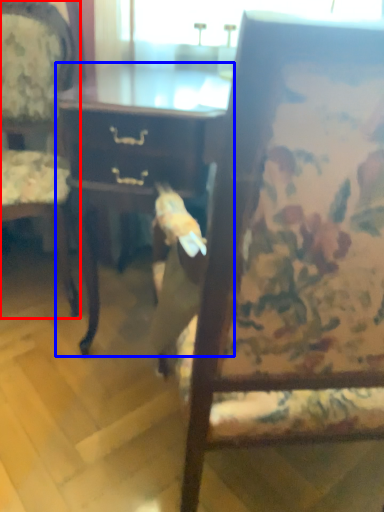
Question: Which object is further to the camera taking this photo, chair (highlighted by a red box) or desk (highlighted by a blue box)?

Choices:
 (A) chair
 (B) desk

Answer: (A)